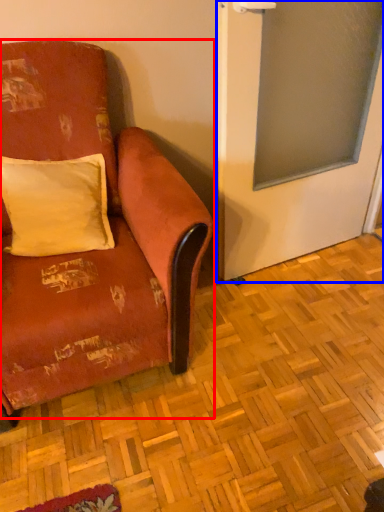
Question: Which object is closer to the camera taking this photo, studio couch (highlighted by a red box) or screen door (highlighted by a blue box)?

Choices:
 (A) studio couch
 (B) screen door

Answer: (A)